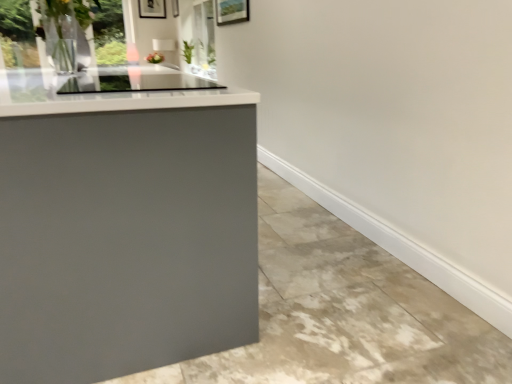
Question: In which direction should I rotate to look at metallic silver picture frame at upper center, the 1th picture frame when ordered from right to left?

Choices:
 (A) right
 (B) left

Answer: (B)

Question: Considering the relative positions of matte black picture frame at upper center, arranged as the 2th picture frame when viewed from the right, and transparent glass window at upper left in the image provided, is matte black picture frame at upper center, arranged as the 2th picture frame when viewed from the right, to the right of transparent glass window at upper left from the viewer's perspective?

Choices:
 (A) yes
 (B) no

Answer: (B)

Question: Is matte black picture frame at upper center, the first picture frame when ordered from left to right, in contact with transparent glass window at upper left?

Choices:
 (A) no
 (B) yes

Answer: (A)

Question: Is matte black picture frame at upper center, the first picture frame when ordered from left to right, outside transparent glass window at upper left?

Choices:
 (A) yes
 (B) no

Answer: (A)

Question: Is matte black picture frame at upper center, arranged as the 2th picture frame when viewed from the right, positioned with its back to transparent glass window at upper left?

Choices:
 (A) no
 (B) yes

Answer: (A)

Question: Does matte black picture frame at upper center, the first picture frame when ordered from left to right, have a greater width compared to transparent glass window at upper left?

Choices:
 (A) no
 (B) yes

Answer: (A)

Question: Is matte black picture frame at upper center, the first picture frame when ordered from left to right, positioned in front of transparent glass window at upper left?

Choices:
 (A) yes
 (B) no

Answer: (B)

Question: Is metallic silver picture frame at upper center, acting as the second picture frame starting from the left, facing away from matte black picture frame at upper center, arranged as the 2th picture frame when viewed from the right?

Choices:
 (A) yes
 (B) no

Answer: (B)

Question: Is metallic silver picture frame at upper center, acting as the second picture frame starting from the left, outside matte black picture frame at upper center, the first picture frame when ordered from left to right?

Choices:
 (A) no
 (B) yes

Answer: (B)

Question: Is metallic silver picture frame at upper center, acting as the second picture frame starting from the left, to the left of matte black picture frame at upper center, arranged as the 2th picture frame when viewed from the right, from the viewer's perspective?

Choices:
 (A) no
 (B) yes

Answer: (A)

Question: Is metallic silver picture frame at upper center, the 1th picture frame when ordered from right to left, thinner than matte black picture frame at upper center, arranged as the 2th picture frame when viewed from the right?

Choices:
 (A) no
 (B) yes

Answer: (A)

Question: Can you confirm if metallic silver picture frame at upper center, acting as the second picture frame starting from the left, is positioned to the right of matte black picture frame at upper center, arranged as the 2th picture frame when viewed from the right?

Choices:
 (A) no
 (B) yes

Answer: (B)

Question: Is metallic silver picture frame at upper center, acting as the second picture frame starting from the left, positioned far away from matte black picture frame at upper center, arranged as the 2th picture frame when viewed from the right?

Choices:
 (A) yes
 (B) no

Answer: (B)

Question: Is transparent glass window at upper left surrounded by matte gray concrete at lower left?

Choices:
 (A) no
 (B) yes

Answer: (A)